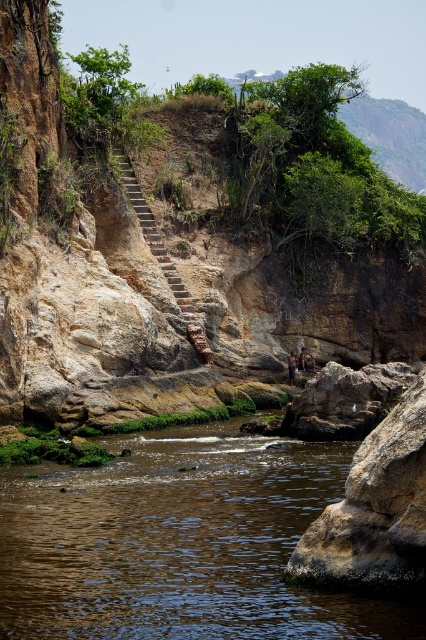
Question: Which of these objects is positioned farthest from the brown rough rock at lower right?

Choices:
 (A) rustic stone stairs at upper center
 (B) tan skin person at center
 (C) brown leather jacket at center
 (D) brown rocky hillside at center

Answer: (C)

Question: Is brown rough rock at lower right to the right of brown leather jacket at center from the viewer's perspective?

Choices:
 (A) no
 (B) yes

Answer: (A)

Question: Observing the image, what is the correct spatial positioning of brown rocky hillside at center in reference to brown leather jacket at center?

Choices:
 (A) right
 (B) left

Answer: (B)

Question: Which point is closer to the camera?

Choices:
 (A) brown rough rock at lower right
 (B) brown leather jacket at center
 (C) tan skin person at center
 (D) brown smooth water at lower left

Answer: (D)

Question: Among these objects, which one is farthest from the camera?

Choices:
 (A) brown leather jacket at center
 (B) tan skin person at center
 (C) brown rocky hillside at center

Answer: (A)

Question: Does brown rough rock at lower right come behind brown leather jacket at center?

Choices:
 (A) yes
 (B) no

Answer: (B)